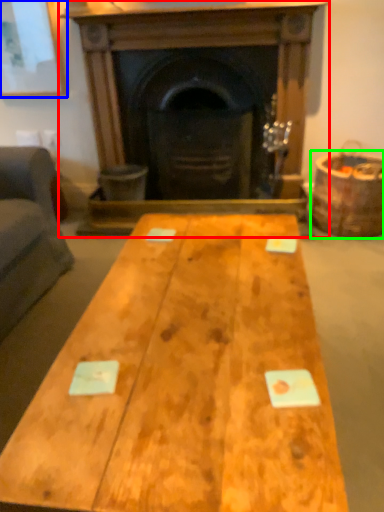
Question: Based on their relative distances, which object is farther from fireplace (highlighted by a red box)? Choose from picture frame (highlighted by a blue box) and barrel (highlighted by a green box).

Choices:
 (A) picture frame
 (B) barrel

Answer: (A)